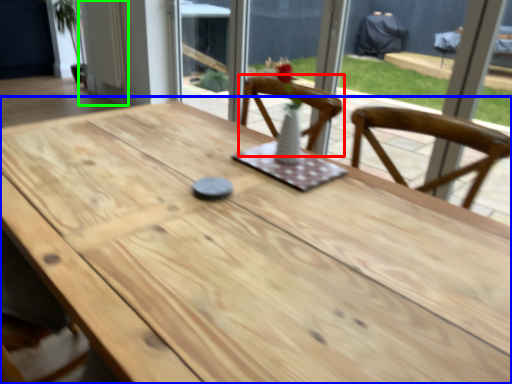
Question: Which is nearer to the chair (highlighted by a red box)? table (highlighted by a blue box) or door (highlighted by a green box).

Choices:
 (A) table
 (B) door

Answer: (A)